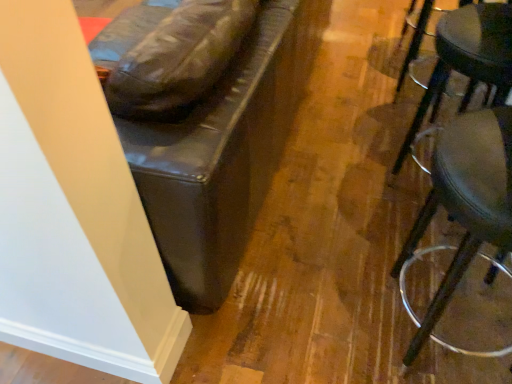
Question: From their relative heights in the image, would you say metallic silver stool at right, the 1th stool positioned from the top, is taller or shorter than metallic silver stool at right, positioned as the 1th stool in bottom-to-top order?

Choices:
 (A) tall
 (B) short

Answer: (B)

Question: Considering their positions, is metallic silver stool at right, acting as the second stool starting from the bottom, located in front of or behind metallic silver stool at right, positioned as the 1th stool in bottom-to-top order?

Choices:
 (A) front
 (B) behind

Answer: (B)

Question: From a real-world perspective, is metallic silver stool at right, the 1th stool positioned from the top, positioned above or below metallic silver stool at right, which ranks as the 2th stool in top-to-bottom order?

Choices:
 (A) below
 (B) above

Answer: (A)

Question: Is metallic silver stool at right, positioned as the 1th stool in bottom-to-top order, taller or shorter than metallic silver stool at right, the 1th stool positioned from the top?

Choices:
 (A) tall
 (B) short

Answer: (A)

Question: From a real-world perspective, relative to metallic silver stool at right, acting as the second stool starting from the bottom, is metallic silver stool at right, positioned as the 1th stool in bottom-to-top order, vertically above or below?

Choices:
 (A) above
 (B) below

Answer: (A)

Question: Considering the positions of metallic silver stool at right, positioned as the 1th stool in bottom-to-top order, and metallic silver stool at right, the 1th stool positioned from the top, in the image, is metallic silver stool at right, positioned as the 1th stool in bottom-to-top order, bigger or smaller than metallic silver stool at right, the 1th stool positioned from the top,?

Choices:
 (A) small
 (B) big

Answer: (B)

Question: Does point (458, 246) appear closer or farther from the camera than point (488, 9)?

Choices:
 (A) closer
 (B) farther

Answer: (B)